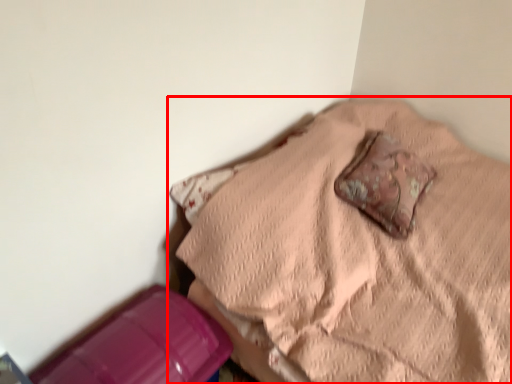
Question: From the image's perspective, where is furniture (annotated by the red box) located relative to pillow?

Choices:
 (A) above
 (B) below

Answer: (B)